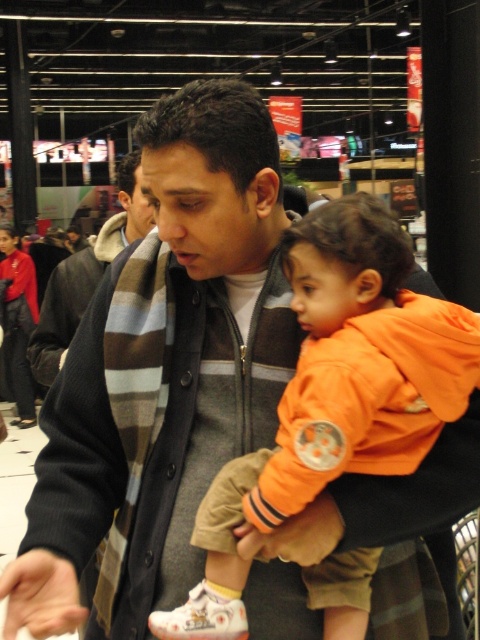
You are a photographer trying to capture a candid shot of the orange fleece jacket at center and the striped wool scarf at center. Which object should you focus on first if you want to include both in your frame without moving the camera?

The orange fleece jacket at center is not as tall as the striped wool scarf at center, so you should focus on the taller striped wool scarf at center first to ensure it fits within the frame.

You are organizing a clothing donation drive and need to pack items into boxes. You have an orange fleece jacket at center and a striped wool scarf at center. Which item should you place in the smaller box to ensure it fits properly?

The orange fleece jacket at center has a smaller size compared to the striped wool scarf at center, so it should be placed in the smaller box to ensure it fits properly.